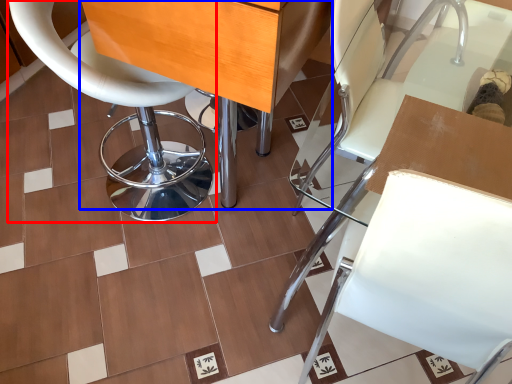
Question: Which object is closer to the camera taking this photo, chair (highlighted by a red box) or table (highlighted by a blue box)?

Choices:
 (A) chair
 (B) table

Answer: (B)